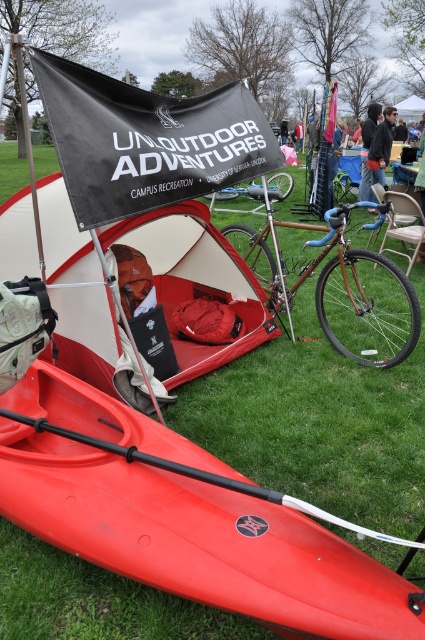
Between dark gray hoodie at upper right and wooden frame bicycle at center, which one appears on the left side from the viewer's perspective?

wooden frame bicycle at center is more to the left.

This screenshot has height=640, width=425. I want to click on dark gray hoodie at upper right, so click(x=376, y=148).

Is point (180, 292) farther from viewer compared to point (299, 134)?

No.

Between matte red tent at center and brown leather jacket at center, which one appears on the right side from the viewer's perspective?

Positioned to the right is brown leather jacket at center.

Is point (65, 230) positioned in front of point (297, 132)?

Yes.

Image resolution: width=425 pixels, height=640 pixels. Find the location of `matte red tent at center`. matte red tent at center is located at coordinates (192, 282).

Is the position of black rubber paddle at lower left more distant than that of dark gray hoodie at upper right?

No, it is not.

The width and height of the screenshot is (425, 640). What are the coordinates of `black rubber paddle at lower left` in the screenshot? It's located at (203, 476).

Find the location of a particular element. The height and width of the screenshot is (640, 425). black rubber paddle at lower left is located at coordinates (203, 476).

Find the location of a particular element. This screenshot has height=640, width=425. black rubber paddle at lower left is located at coordinates (203, 476).